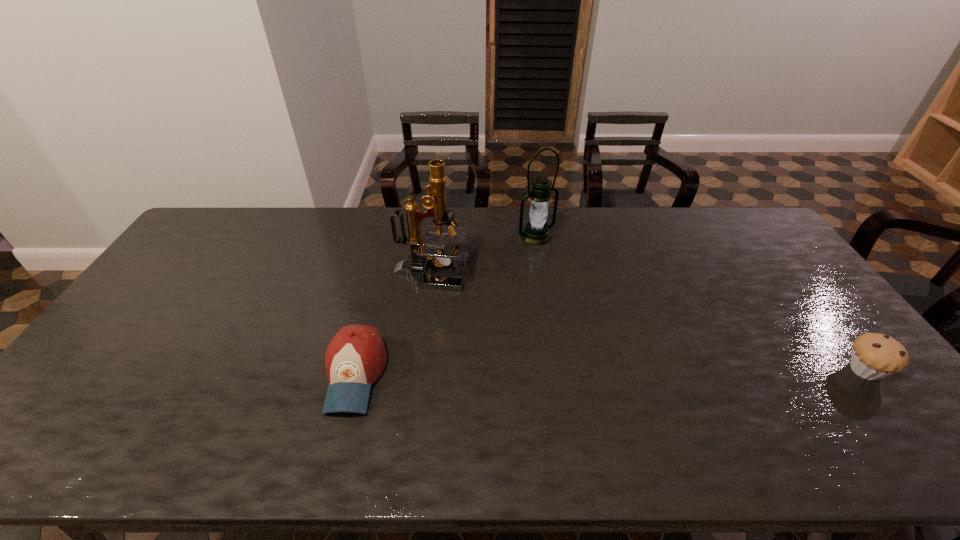
In order to click on blank space located on the side where the second object from right to left emits light in this screenshot , I will do `click(556, 254)`.

I want to click on vacant region located on the side where the second object from right to left emits light, so click(x=606, y=305).

Locate an element on the screen. This screenshot has height=540, width=960. object that is at the far edge is located at coordinates (537, 232).

What are the coordinates of `baseball cap present at the near edge` in the screenshot? It's located at (356, 356).

You are a GUI agent. You are given a task and a screenshot of the screen. Output one action in this format:
    pyautogui.click(x=<x>, y=<y>)
    Task: Click on the muffin that is at the near edge
    The width and height of the screenshot is (960, 540).
    Given the screenshot: What is the action you would take?
    tap(874, 355)

You are a GUI agent. You are given a task and a screenshot of the screen. Output one action in this format:
    pyautogui.click(x=<x>, y=<y>)
    Task: Click on the object situated at the right edge
    The height and width of the screenshot is (540, 960).
    Given the screenshot: What is the action you would take?
    pyautogui.click(x=874, y=355)

You are a GUI agent. You are given a task and a screenshot of the screen. Output one action in this format:
    pyautogui.click(x=<x>, y=<y>)
    Task: Click on the object that is at the near right corner
    The image size is (960, 540).
    Given the screenshot: What is the action you would take?
    pyautogui.click(x=874, y=355)

Locate an element on the screen. The image size is (960, 540). vacant space at the far edge of the desktop is located at coordinates (513, 238).

This screenshot has height=540, width=960. Find the location of `free space at the near edge of the desktop`. free space at the near edge of the desktop is located at coordinates (197, 388).

In the image, there is a desktop. Where is `vacant area at the left edge`? vacant area at the left edge is located at coordinates (175, 260).